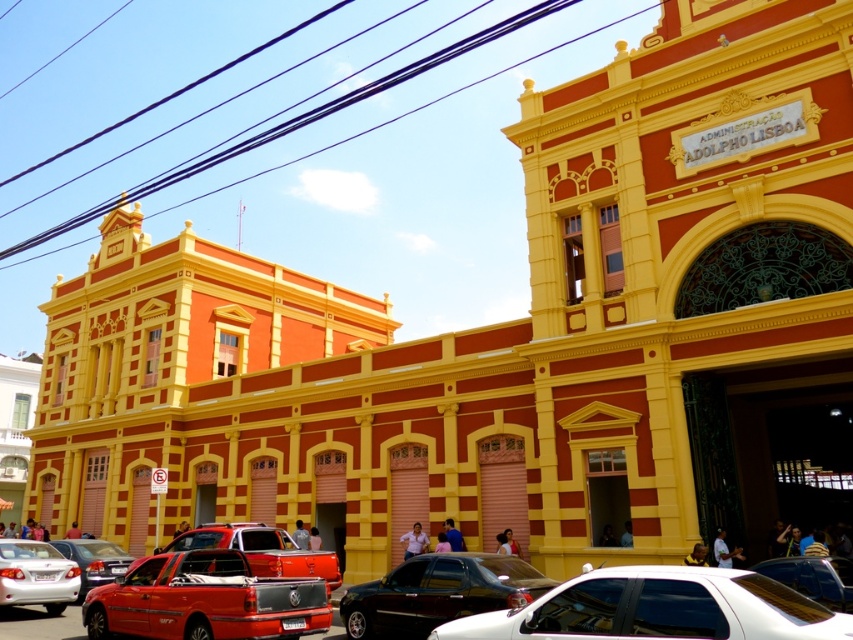
Question: Which of the following is the farthest from the observer?

Choices:
 (A) (117, 572)
 (B) (376, 632)

Answer: (A)

Question: In this image, where is metallic red truck at lower left located relative to metallic silver car at lower left?

Choices:
 (A) below
 (B) above

Answer: (B)

Question: Is white glossy car at lower center wider than shiny silver car at lower right?

Choices:
 (A) yes
 (B) no

Answer: (A)

Question: Which point is farther to the camera?

Choices:
 (A) (375, 589)
 (B) (91, 636)
 (C) (827, 564)

Answer: (A)

Question: Which is farther from the metallic red pickup truck at center?

Choices:
 (A) shiny black sedan at center
 (B) metallic red truck at lower left
 (C) white glossy car at lower center
 (D) shiny silver car at lower right

Answer: (D)

Question: Is the position of metallic red truck at lower left less distant than that of white matte sedan at lower left?

Choices:
 (A) no
 (B) yes

Answer: (B)